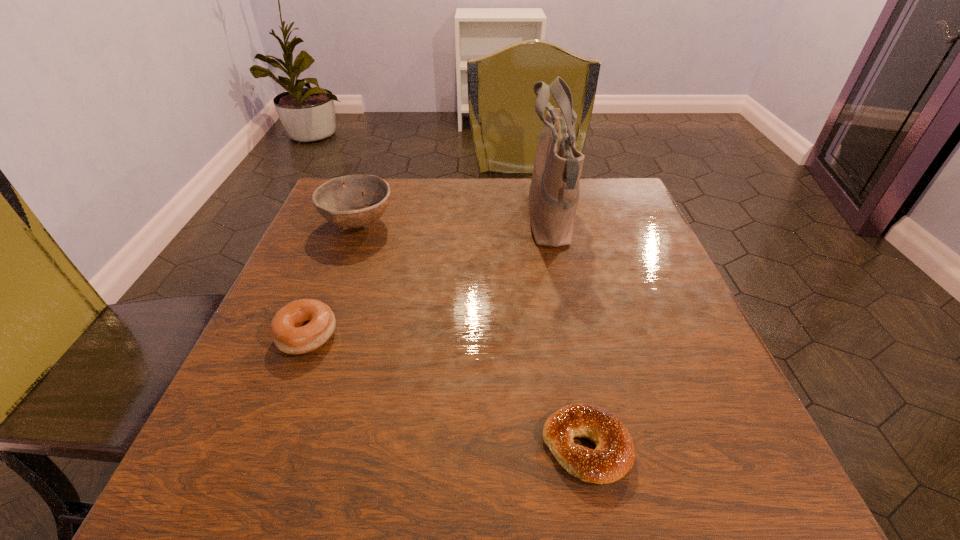
This screenshot has width=960, height=540. I want to click on the tallest object, so click(554, 191).

The height and width of the screenshot is (540, 960). Find the location of `bowl`. bowl is located at coordinates 341,200.

I want to click on the third farthest object, so click(x=301, y=326).

The width and height of the screenshot is (960, 540). Find the location of `the left bagel`. the left bagel is located at coordinates (301, 326).

This screenshot has width=960, height=540. I want to click on the shorter bagel, so click(614, 455).

Where is `the shortest object`? The image size is (960, 540). the shortest object is located at coordinates coord(614,455).

This screenshot has height=540, width=960. What are the coordinates of `free spot located on the front-facing side of the tallest object` in the screenshot? It's located at (423, 221).

Locate an element on the screen. The height and width of the screenshot is (540, 960). vacant space located on the front-facing side of the tallest object is located at coordinates (428, 221).

I want to click on vacant region located 0.340m on the front-facing side of the tallest object, so click(x=382, y=221).

Where is `vacant space situated on the right of the second tallest object`? The height and width of the screenshot is (540, 960). vacant space situated on the right of the second tallest object is located at coordinates (458, 223).